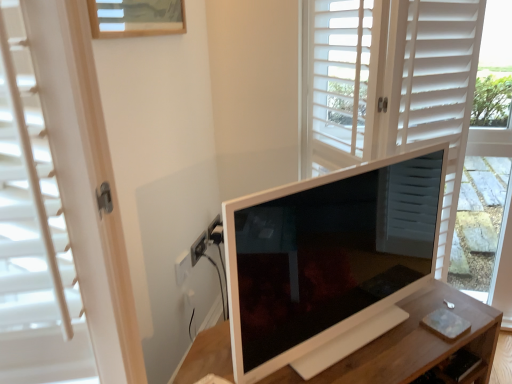
Question: From a real-world perspective, is white glossy monitor at center physically located above or below wooden drawer at lower right?

Choices:
 (A) below
 (B) above

Answer: (B)

Question: Is white glossy monitor at center situated inside wooden drawer at lower right or outside?

Choices:
 (A) outside
 (B) inside

Answer: (A)

Question: Which of these objects is positioned closest to the wooden drawer at lower right?

Choices:
 (A) matte white screen door at center
 (B) white glossy monitor at center
 (C) white wooden table at center

Answer: (C)

Question: Which object is the farthest from the matte white screen door at center?

Choices:
 (A) wooden drawer at lower right
 (B) white glossy monitor at center
 (C) white wooden table at center

Answer: (A)